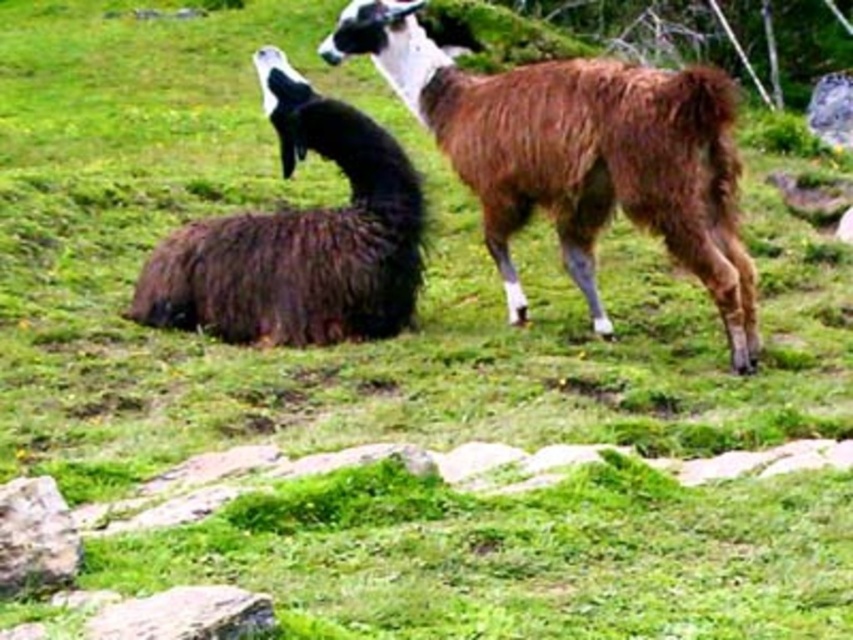
Does brown woolly alpaca at center have a greater height compared to dark brown woolen goat at center?

Indeed, brown woolly alpaca at center has a greater height compared to dark brown woolen goat at center.

Is point (669, 102) closer to viewer compared to point (412, 262)?

Yes, point (669, 102) is closer to viewer.

Who is more distant from viewer, (738, 256) or (415, 259)?

The point (415, 259) is behind.

At what (x,y) coordinates should I click in order to perform the action: click on brown woolly alpaca at center. Please return your answer as a coordinate pair (x, y). Image resolution: width=853 pixels, height=640 pixels. Looking at the image, I should click on (577, 154).